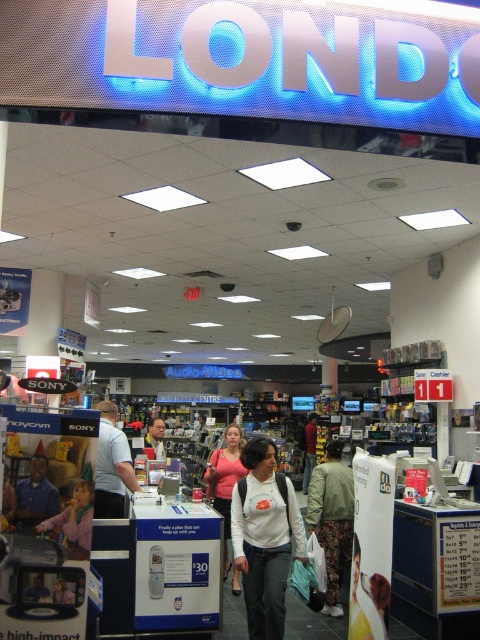
Question: In this image, where is white matte shirt at center located relative to matte blue shirt at lower left?

Choices:
 (A) right
 (B) left

Answer: (A)

Question: Which point appears farthest from the camera in this image?

Choices:
 (A) (16, 516)
 (B) (104, 410)
 (C) (160, 456)

Answer: (C)

Question: From the image, what is the correct spatial relationship of pink fabric shirt at center in relation to matte blue shirt at lower left?

Choices:
 (A) above
 (B) below

Answer: (B)

Question: Among these objects, which one is farthest from the camera?

Choices:
 (A) smooth skin face at center
 (B) pink fabric shirt at center
 (C) white matte shirt at center

Answer: (A)

Question: Does white matte shirt at center appear on the right side of smooth skin face at center?

Choices:
 (A) no
 (B) yes

Answer: (B)

Question: Among these objects, which one is nearest to the camera?

Choices:
 (A) pink fabric shirt at center
 (B) white matte shirt at center

Answer: (B)